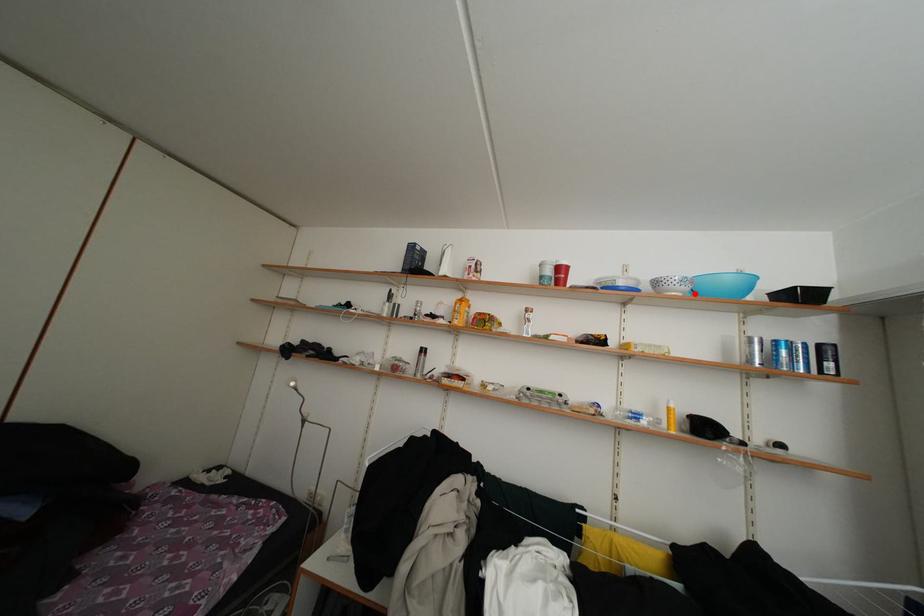
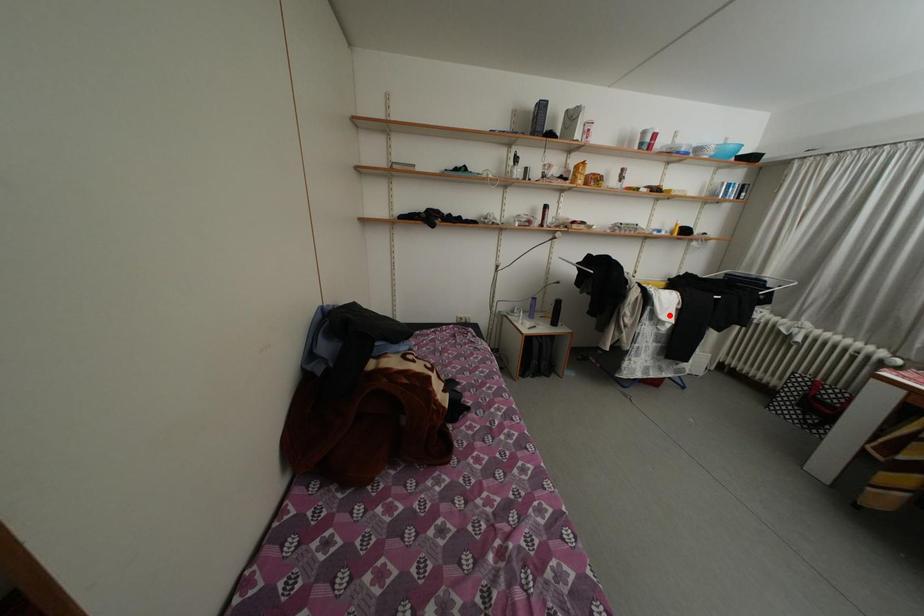
I am providing you with two images of the same scene from different viewpoints. A red point is marked on the first image and another point is marked on the second image. Is the red point in image1 aligned with the point shown in image2?

No